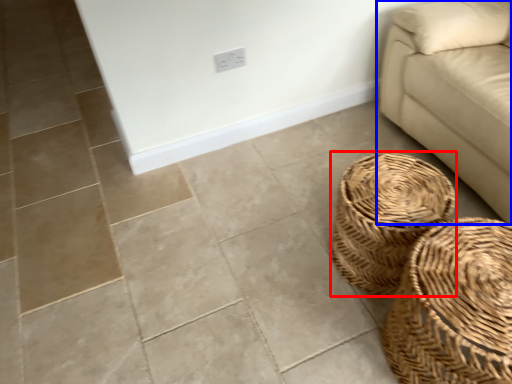
Question: Which object is closer to the camera taking this photo, basket (highlighted by a red box) or studio couch (highlighted by a blue box)?

Choices:
 (A) basket
 (B) studio couch

Answer: (B)